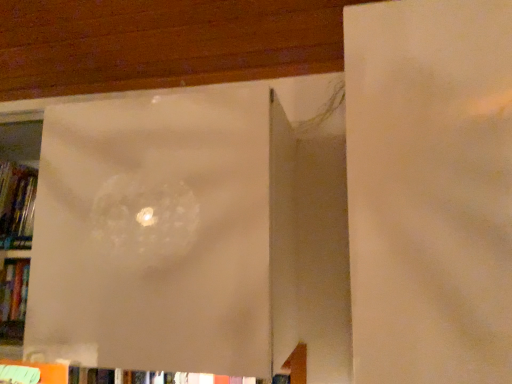
Question: From a real-world perspective, is hardcover book at left positioned under transparent plastic bag at center based on gravity?

Choices:
 (A) no
 (B) yes

Answer: (A)

Question: Does hardcover book at left appear on the right side of transparent plastic bag at center?

Choices:
 (A) yes
 (B) no

Answer: (B)

Question: Is hardcover book at left facing away from transparent plastic bag at center?

Choices:
 (A) no
 (B) yes

Answer: (B)

Question: Considering the relative sizes of hardcover book at left and transparent plastic bag at center in the image provided, is hardcover book at left shorter than transparent plastic bag at center?

Choices:
 (A) yes
 (B) no

Answer: (A)

Question: From the image's perspective, would you say hardcover book at left is shown under transparent plastic bag at center?

Choices:
 (A) no
 (B) yes

Answer: (A)

Question: Does hardcover book at left contain transparent plastic bag at center?

Choices:
 (A) no
 (B) yes

Answer: (A)

Question: Can you confirm if transparent plastic bag at center is positioned to the right of hardcover book at left?

Choices:
 (A) no
 (B) yes

Answer: (B)

Question: Is hardcover book at left surrounded by transparent plastic bag at center?

Choices:
 (A) no
 (B) yes

Answer: (B)

Question: From the image's perspective, is transparent plastic bag at center above hardcover book at left?

Choices:
 (A) yes
 (B) no

Answer: (B)

Question: From the image's perspective, is transparent plastic bag at center below hardcover book at left?

Choices:
 (A) no
 (B) yes

Answer: (B)

Question: Considering the relative sizes of transparent plastic bag at center and hardcover book at left in the image provided, is transparent plastic bag at center shorter than hardcover book at left?

Choices:
 (A) no
 (B) yes

Answer: (A)

Question: Does transparent plastic bag at center have a lesser width compared to hardcover book at left?

Choices:
 (A) no
 (B) yes

Answer: (A)

Question: Looking at their shapes, would you say transparent plastic bag at center is wider or thinner than hardcover book at left?

Choices:
 (A) wide
 (B) thin

Answer: (A)